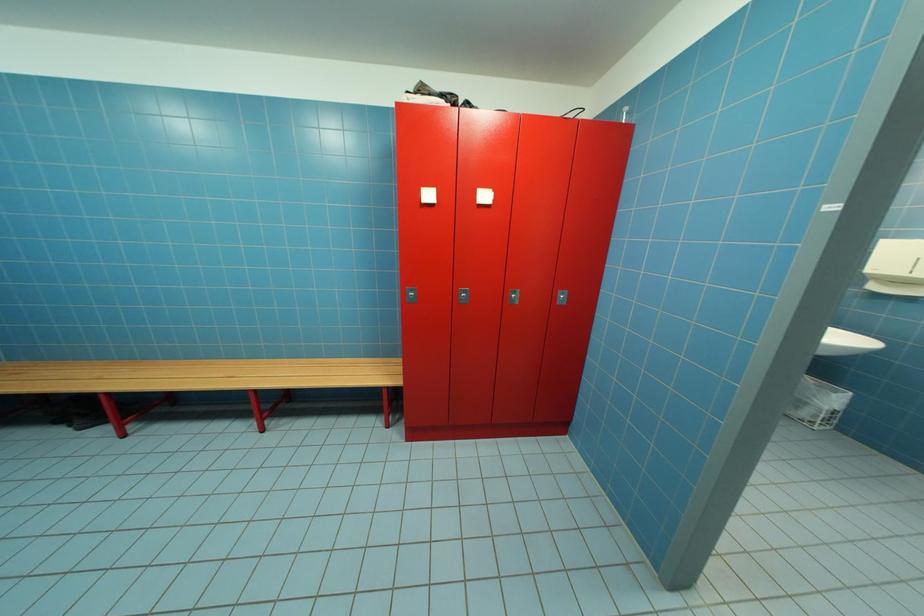
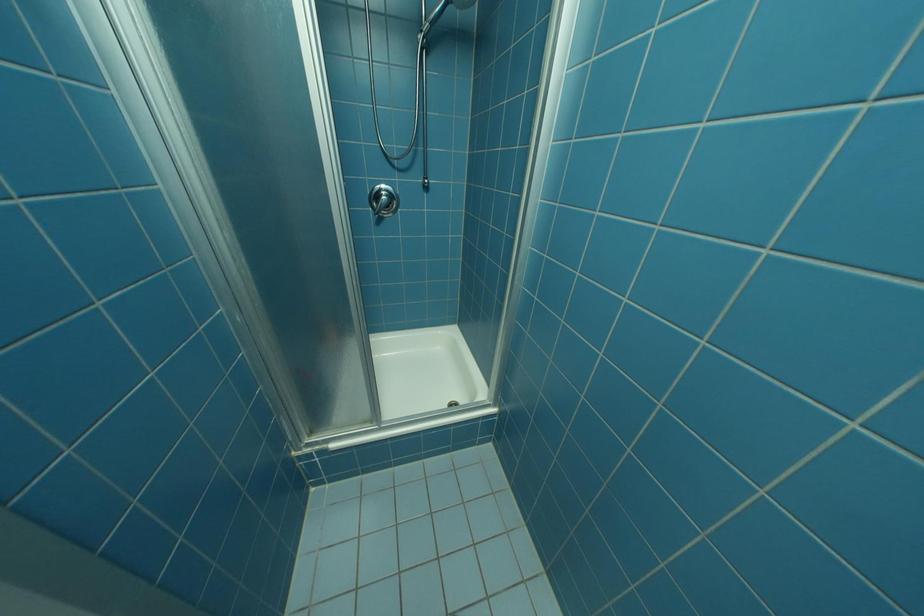
Question: What movement of the cameraman would produce the second image?

Choices:
 (A) Left
 (B) Right
 (C) Forward
 (D) Backward

Answer: (B)